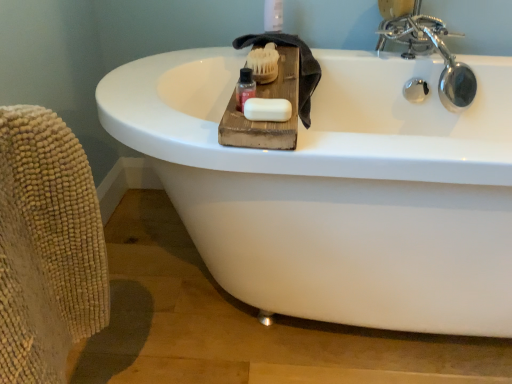
Question: Can we say beige textured armchair at left lies outside translucent plastic bottle at upper center?

Choices:
 (A) yes
 (B) no

Answer: (A)

Question: From the image's perspective, is beige textured armchair at left below translucent plastic bottle at upper center?

Choices:
 (A) yes
 (B) no

Answer: (A)

Question: From a real-world perspective, is beige textured armchair at left positioned over translucent plastic bottle at upper center based on gravity?

Choices:
 (A) no
 (B) yes

Answer: (A)

Question: Does beige textured armchair at left have a lesser width compared to translucent plastic bottle at upper center?

Choices:
 (A) yes
 (B) no

Answer: (B)

Question: Considering the relative positions of beige textured armchair at left and translucent plastic bottle at upper center in the image provided, is beige textured armchair at left to the left of translucent plastic bottle at upper center from the viewer's perspective?

Choices:
 (A) no
 (B) yes

Answer: (B)

Question: Considering the positions of white matte soap at center and chrome metallic faucet at upper right in the image, is white matte soap at center wider or thinner than chrome metallic faucet at upper right?

Choices:
 (A) wide
 (B) thin

Answer: (B)

Question: Relative to chrome metallic faucet at upper right, is white matte soap at center in front or behind?

Choices:
 (A) behind
 (B) front

Answer: (B)

Question: From the image's perspective, is white matte soap at center located above or below chrome metallic faucet at upper right?

Choices:
 (A) below
 (B) above

Answer: (A)

Question: Considering the positions of white matte soap at center and chrome metallic faucet at upper right in the image, is white matte soap at center bigger or smaller than chrome metallic faucet at upper right?

Choices:
 (A) small
 (B) big

Answer: (A)

Question: In terms of size, does translucent plastic bottle at upper center appear bigger or smaller than beige textured armchair at left?

Choices:
 (A) small
 (B) big

Answer: (A)

Question: Considering the positions of translucent plastic bottle at upper center and beige textured armchair at left in the image, is translucent plastic bottle at upper center wider or thinner than beige textured armchair at left?

Choices:
 (A) thin
 (B) wide

Answer: (A)

Question: In the image, is translucent plastic bottle at upper center on the left side or the right side of beige textured armchair at left?

Choices:
 (A) left
 (B) right

Answer: (B)

Question: Relative to beige textured armchair at left, is translucent plastic bottle at upper center in front or behind?

Choices:
 (A) behind
 (B) front

Answer: (A)

Question: Choose the correct answer: Is white matte soap at center inside beige textured armchair at left or outside it?

Choices:
 (A) inside
 (B) outside

Answer: (B)

Question: Is point [249, 119] positioned closer to the camera than point [58, 173]?

Choices:
 (A) farther
 (B) closer

Answer: (A)